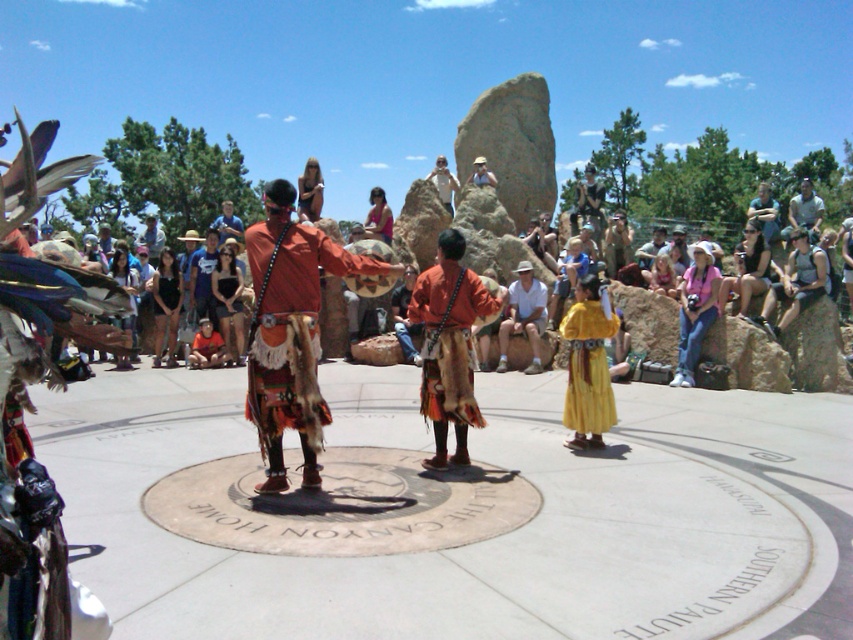
Question: Does orange fur skirt at center have a lesser width compared to yellow fabric skirt at center?

Choices:
 (A) yes
 (B) no

Answer: (B)

Question: Which object appears closest to the camera in this image?

Choices:
 (A) light brown leather hat at center
 (B) light blue denim shirt at upper right
 (C) white cotton shirt at center

Answer: (C)

Question: Does pink fabric dress at center appear over white cotton shirt at center?

Choices:
 (A) no
 (B) yes

Answer: (B)

Question: Which of the following is the closest to the observer?

Choices:
 (A) click(474, 168)
 (B) click(595, 333)
 (C) click(306, 276)

Answer: (C)

Question: Is orange fur skirt at center to the left of yellow fabric skirt at center from the viewer's perspective?

Choices:
 (A) yes
 (B) no

Answer: (A)

Question: Estimate the real-world distances between objects in this image. Which object is closer to the matte pink dress at center?

Choices:
 (A) yellow fabric skirt at center
 (B) light blue denim shirt at upper right

Answer: (A)